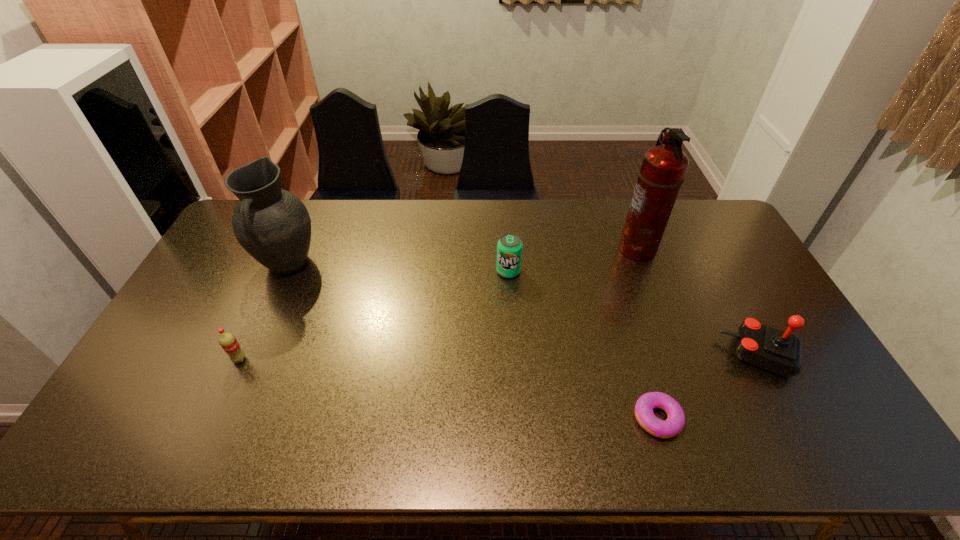
Find the location of `the tallest object`. the tallest object is located at coordinates (663, 168).

The height and width of the screenshot is (540, 960). Find the location of `the fifth shortest object`. the fifth shortest object is located at coordinates (273, 225).

You are a GUI agent. You are given a task and a screenshot of the screen. Output one action in this format:
    pyautogui.click(x=<x>, y=<y>)
    Task: Click on the third tallest object
    Image resolution: width=960 pixels, height=540 pixels.
    Given the screenshot: What is the action you would take?
    pyautogui.click(x=780, y=352)

At what (x,y) coordinates should I click in order to perform the action: click on the rightmost object. Please return your answer as a coordinate pair (x, y). Looking at the image, I should click on (780, 352).

The image size is (960, 540). Find the location of `the right soda`. the right soda is located at coordinates (509, 247).

Where is `the fourth object from right to left`? The width and height of the screenshot is (960, 540). the fourth object from right to left is located at coordinates (509, 247).

At what (x,y) coordinates should I click in order to perform the action: click on the nearer soda. Please return your answer as a coordinate pair (x, y). The image size is (960, 540). Looking at the image, I should click on (228, 342).

Find the location of `the shortest object`. the shortest object is located at coordinates (673, 425).

Find the location of a particular element. The width and height of the screenshot is (960, 540). doughnut is located at coordinates (673, 425).

Locate an element on the screen. The width and height of the screenshot is (960, 540). free space located 0.140m on the nozzle side of the tallest object is located at coordinates (578, 248).